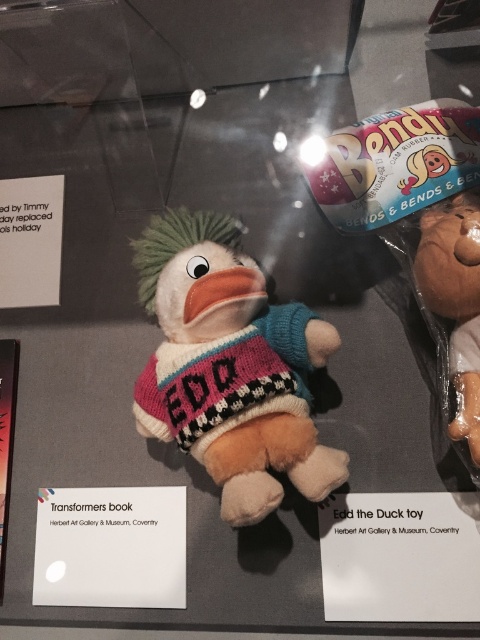
You are a customer at a toy store looking at the display case. You want to know which item is taller between the fluffy multicolored duck at center and the matte brown plush toy at right. Can you tell me which one is taller?

The fluffy multicolored duck at center is taller than the matte brown plush toy at right according to the description.

You are a customer looking at the display case and want to pick up the fluffy multicolored duck at center and the matte brown plush toy at right. Which one is closer to you?

The fluffy multicolored duck at center is closer to you because it is in front of the matte brown plush toy at right.

You are a customer at a store and want to know if you can fit both the fluffy multicolored duck at center and the matte brown plush toy at right into a gift box that is 12 inches wide. Can you do it?

The fluffy multicolored duck at center and the matte brown plush toy at right are 11.06 inches apart from each other. Since the total distance between them is less than the 12 inch width of the box, they can fit together in the box.